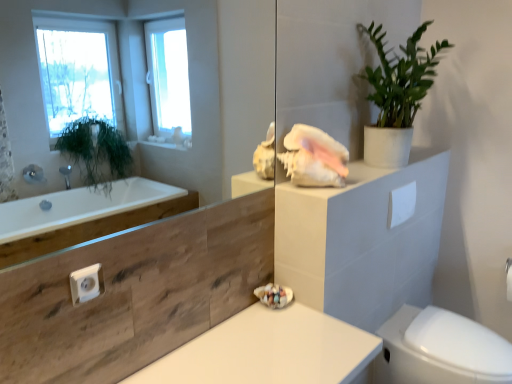
Question: Is white matte countertop at center outside of white matte toilet paper at upper right?

Choices:
 (A) yes
 (B) no

Answer: (A)

Question: Does white matte countertop at center have a greater width compared to white matte toilet paper at upper right?

Choices:
 (A) yes
 (B) no

Answer: (A)

Question: Does white matte countertop at center appear on the left side of white matte toilet paper at upper right?

Choices:
 (A) yes
 (B) no

Answer: (A)

Question: Is white matte countertop at center turned away from white matte toilet paper at upper right?

Choices:
 (A) no
 (B) yes

Answer: (A)

Question: From the image's perspective, does white matte countertop at center appear lower than white matte toilet paper at upper right?

Choices:
 (A) no
 (B) yes

Answer: (B)

Question: From a real-world perspective, is white matte countertop at center on top of white matte toilet paper at upper right?

Choices:
 (A) yes
 (B) no

Answer: (B)

Question: Considering the relative positions of white glossy bidet at lower right and transparent glass mirror at upper center in the image provided, is white glossy bidet at lower right to the left of transparent glass mirror at upper center from the viewer's perspective?

Choices:
 (A) yes
 (B) no

Answer: (B)

Question: Could transparent glass mirror at upper center be considered to be inside white glossy bidet at lower right?

Choices:
 (A) no
 (B) yes

Answer: (A)

Question: Can you see white glossy bidet at lower right touching transparent glass mirror at upper center?

Choices:
 (A) yes
 (B) no

Answer: (B)

Question: Is white glossy bidet at lower right far from transparent glass mirror at upper center?

Choices:
 (A) yes
 (B) no

Answer: (A)

Question: Is the position of white glossy bidet at lower right less distant than that of transparent glass mirror at upper center?

Choices:
 (A) no
 (B) yes

Answer: (A)

Question: Is the depth of white glossy bidet at lower right greater than that of transparent glass mirror at upper center?

Choices:
 (A) yes
 (B) no

Answer: (A)

Question: Is transparent glass mirror at upper center not close to white matte countertop at center?

Choices:
 (A) yes
 (B) no

Answer: (A)